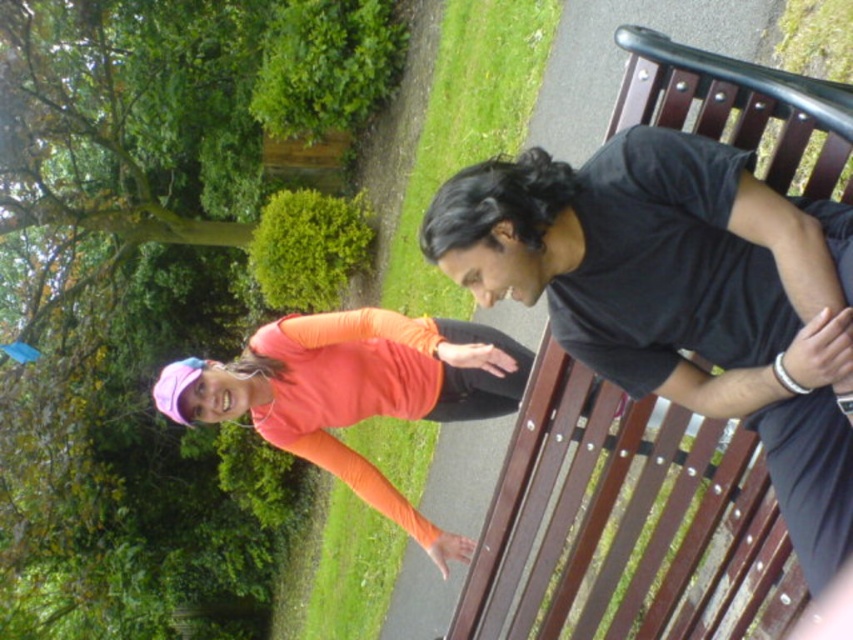
You are standing at the point marked as point (694, 90) in the park. You want to walk straight ahead to a tree that is 2 meters away from you. Will you reach the tree before walking 2 meters?

The distance between point (694, 90) and the viewer is 1.72 meters. Since the tree is 2 meters away from you, you will reach the tree before walking 2 meters because the distance to the tree is less than 2 meters.

You are a photographer trying to capture a candid shot of the orange matte shirt at center without including the brown wood bench at center in the frame. Given their positions, is this possible?

The brown wood bench at center is positioned under orange matte shirt at center, so the bench is directly beneath the shirt. This means the orange matte shirt at center is above the bench, so capturing the shirt without the bench would be challenging as the bench is underneath it and likely in the same frame.

You are planning to place a small potted plant between the brown wood bench at center and the orange matte shirt at center. Based on their sizes, which object should the plant be closer to?

The brown wood bench at center is smaller than orange matte shirt at center, so the plant should be placed closer to the brown wood bench at center to maintain balance between the two objects.